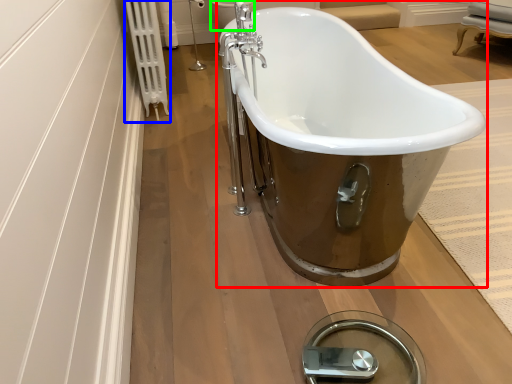
Question: Which object is positioned farthest from bathtub (highlighted by a red box)? Select from radiator (highlighted by a blue box) and toilet bowl (highlighted by a green box).

Choices:
 (A) radiator
 (B) toilet bowl

Answer: (B)